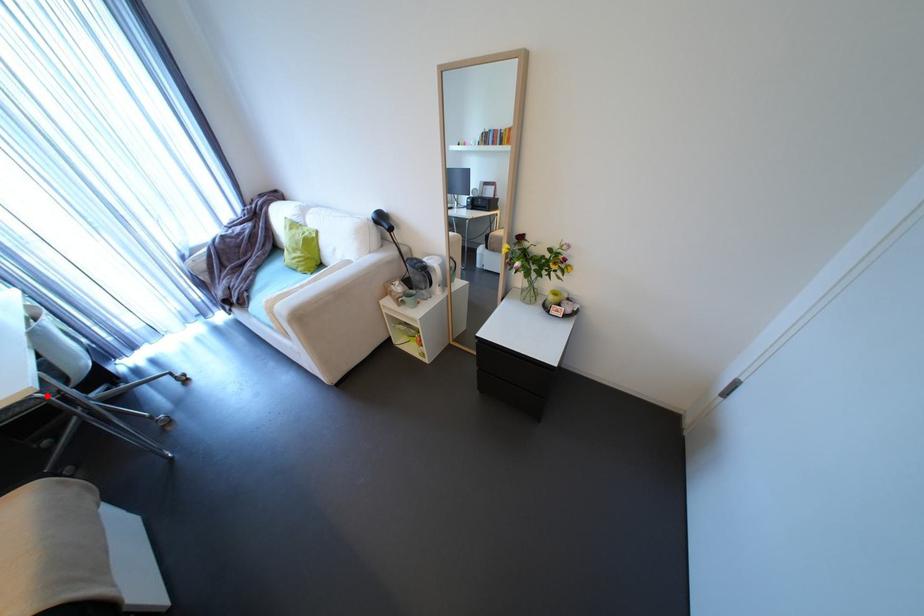
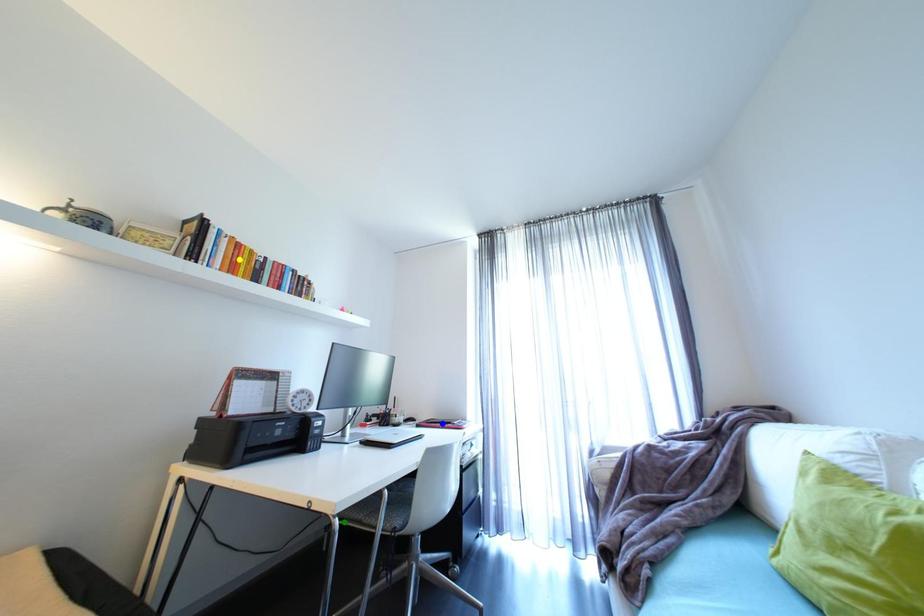
Question: I am providing you with two images of the same scene from different viewpoints. A red point is marked on the first image. You are given multiple points on the second image. Which point in image 2 is actually the same real-world point as the red point in image 1?

Choices:
 (A) yellow point
 (B) green point
 (C) blue point

Answer: (B)